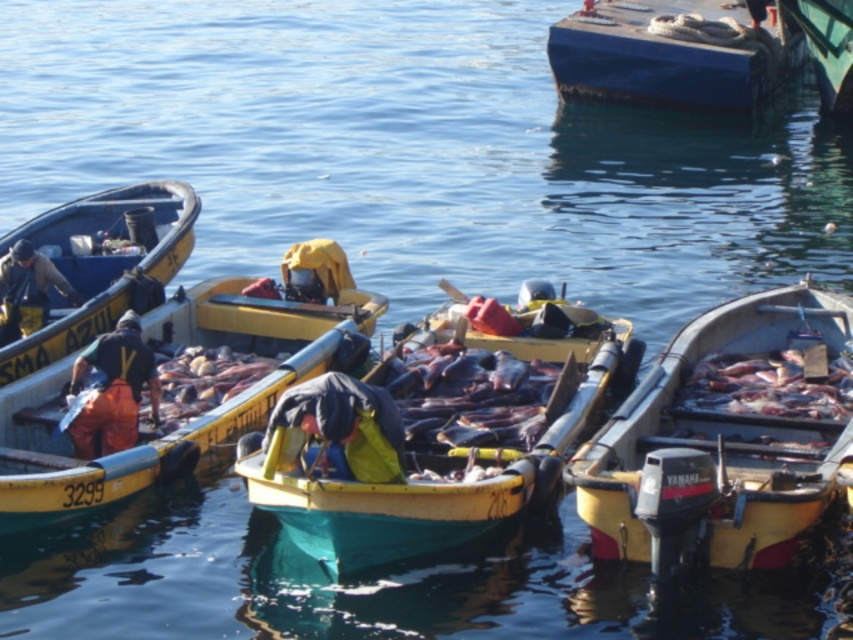
From the picture: You are standing at the point marked as point (186, 412). What object is located exactly at that point?

The yellow plastic boat at center is located exactly at point (186, 412).